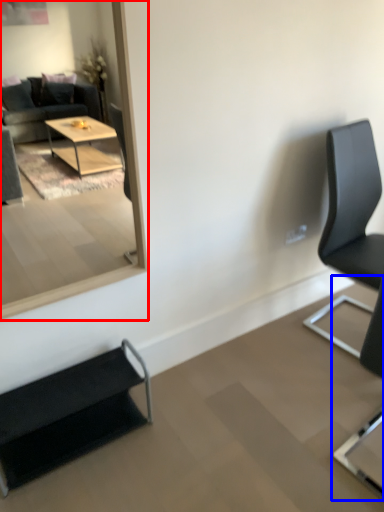
Question: Among these objects, which one is farthest to the camera, mirror (highlighted by a red box) or chair (highlighted by a blue box)?

Choices:
 (A) mirror
 (B) chair

Answer: (A)